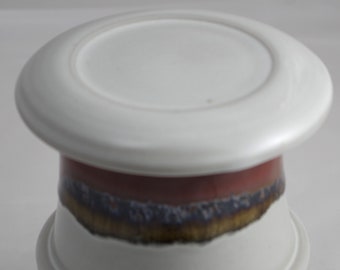
Where is `recessed area`? recessed area is located at coordinates (191, 88).